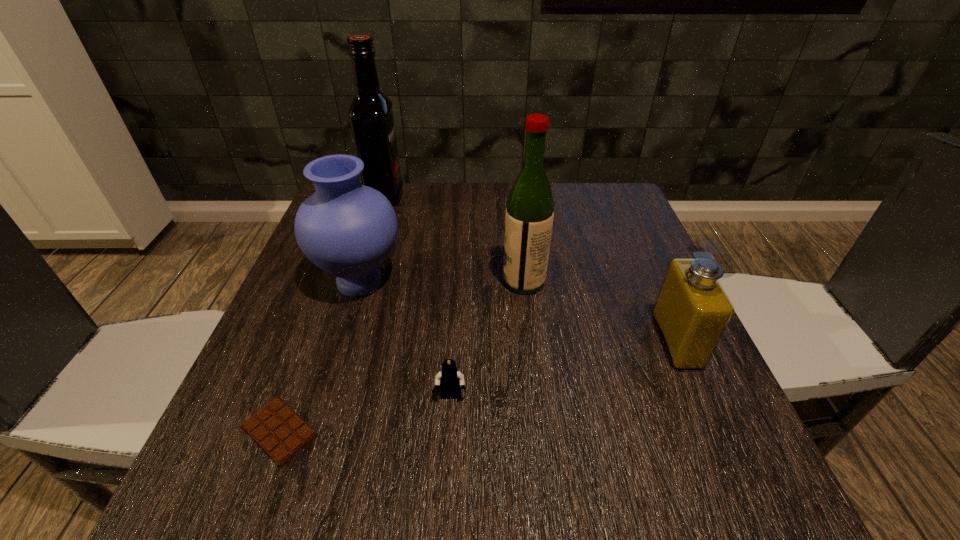
I want to click on object at the far edge, so click(x=371, y=118).

Locate an element on the screen. Image resolution: width=960 pixels, height=540 pixels. object that is at the near edge is located at coordinates (279, 431).

Where is `liquor at the left edge`? liquor at the left edge is located at coordinates (371, 118).

Image resolution: width=960 pixels, height=540 pixels. What are the coordinates of `vase at the left edge` in the screenshot? It's located at (346, 229).

Where is `candy bar that is at the left edge`? candy bar that is at the left edge is located at coordinates (279, 431).

Locate an element on the screen. The image size is (960, 540). object situated at the right edge is located at coordinates (692, 311).

Where is `object positioned at the far left corner`? The width and height of the screenshot is (960, 540). object positioned at the far left corner is located at coordinates (371, 118).

Identify the location of object situated at the near left corner. Image resolution: width=960 pixels, height=540 pixels. (279, 431).

Find the location of `free region at the left edge of the desktop`. free region at the left edge of the desktop is located at coordinates (274, 372).

This screenshot has height=540, width=960. In order to click on vacant area at the right edge in this screenshot , I will do click(616, 240).